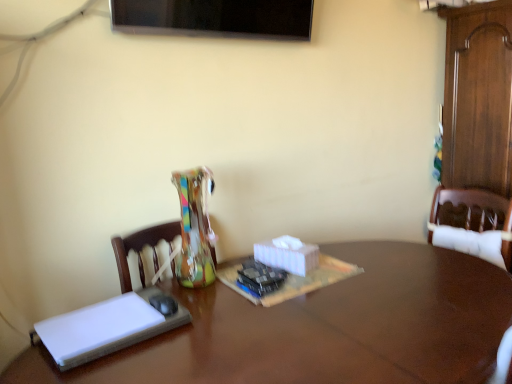
Identify the location of free space above brown wooden table at center (from a real-world perspective). The image size is (512, 384). (292, 320).